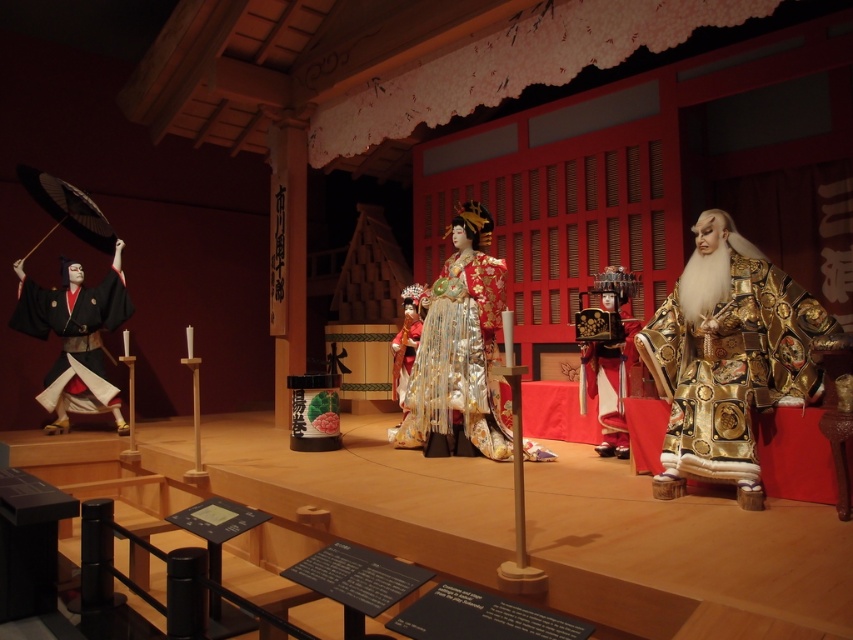
You are a museum visitor who wants to take a photo of both the gold shiny robe at right and the silk kimono at center. Since you can only focus on one object at a time, which one should you focus on to ensure the other is still in the background?

You should focus on the silk kimono at center because the gold shiny robe at right is shorter than it, so the robe will still be visible in the background.

You are a visitor at the museum and want to locate the gold shiny robe at right. According to the coordinates provided, where should you look in the image?

The gold shiny robe at right is located at coordinates point (x=727, y=356) in the image.

You are a visitor at this museum exhibit and want to take a photo of both the gold shiny robe at right and the silk kimono at center. Since you can only focus on one object at a time, which one should you focus on to ensure the other is still in the background?

You should focus on the gold shiny robe at right because it is closer to the viewer than the silk kimono at center, so focusing on it will keep the silk kimono at center in the background.